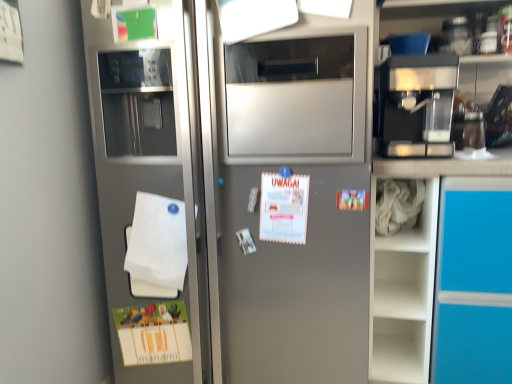
Image resolution: width=512 pixels, height=384 pixels. What do you see at coordinates (288, 197) in the screenshot? I see `satin silver refrigerator at left` at bounding box center [288, 197].

This screenshot has width=512, height=384. What do you see at coordinates (406, 241) in the screenshot?
I see `white fabric at right` at bounding box center [406, 241].

The image size is (512, 384). Identify the location of metallic espresso machine at upper right. (417, 105).

This screenshot has height=384, width=512. What do you see at coordinates (156, 247) in the screenshot?
I see `white matte notepad at lower left` at bounding box center [156, 247].

Locate an element on the screen. white matte paper at upper center is located at coordinates (254, 17).

This screenshot has width=512, height=384. What do you see at coordinates (254, 17) in the screenshot? I see `white matte paper at upper center` at bounding box center [254, 17].

The width and height of the screenshot is (512, 384). In order to click on satin silver refrigerator at left in this screenshot , I will do pyautogui.click(x=288, y=197).

Is metallic espresso machine at upper right in front of or behind white fabric at right in the image?

Clearly, metallic espresso machine at upper right is in front of white fabric at right.

Is metallic espresso machine at upper right surrounding white fabric at right?

No, white fabric at right is located outside of metallic espresso machine at upper right.

Which object is closer to the camera, white matte notepad at lower left or white matte paper at upper center?

white matte paper at upper center is closer to the camera.

Is white matte notepad at lower left outside of white matte paper at upper center?

Yes, white matte notepad at lower left is located beyond the bounds of white matte paper at upper center.

From the image's perspective, is white matte notepad at lower left above or below white matte paper at upper center?

Based on their image positions, white matte notepad at lower left is located beneath white matte paper at upper center.

In terms of height, does white fabric at right look taller or shorter compared to satin silver refrigerator at left?

white fabric at right is shorter than satin silver refrigerator at left.

Where is `refrigerator located above the white fabric at right (from a real-world perspective)`? The width and height of the screenshot is (512, 384). refrigerator located above the white fabric at right (from a real-world perspective) is located at coordinates (288, 197).

Is point (387, 241) farther from camera compared to point (254, 215)?

Yes, point (387, 241) is behind point (254, 215).

From a real-world perspective, is white matte notepad at lower left below satin silver refrigerator at left?

Yes.

Is white matte notepad at lower left far away from satin silver refrigerator at left?

No, white matte notepad at lower left is not far away from satin silver refrigerator at left.

Is point (166, 267) farther from viewer compared to point (302, 158)?

Yes, it is behind point (302, 158).

Based on their positions, is white matte notepad at lower left located to the left or right of satin silver refrigerator at left?

In the image, white matte notepad at lower left appears on the left side of satin silver refrigerator at left.

From a real-world perspective, who is located higher, white matte paper at upper center or white fabric at right?

From a 3D spatial view, white matte paper at upper center is above.

The height and width of the screenshot is (384, 512). I want to click on cabinet behind the white matte paper at upper center, so coord(406,241).

Is white matte paper at upper center not close to white fabric at right?

white matte paper at upper center is actually quite close to white fabric at right.

Consider the image. From the image's perspective, would you say white matte paper at upper center is shown under white fabric at right?

No, from the image's perspective, white matte paper at upper center is not beneath white fabric at right.

Which of these two, white fabric at right or metallic espresso machine at upper right, is smaller?

With smaller size is white fabric at right.

Is white fabric at right at the right side of metallic espresso machine at upper right?

In fact, white fabric at right is to the left of metallic espresso machine at upper right.

Does white fabric at right lie in front of metallic espresso machine at upper right?

No, white fabric at right is further to the viewer.

Is white fabric at right positioned with its back to metallic espresso machine at upper right?

white fabric at right does not have its back to metallic espresso machine at upper right.

Which of these two, white fabric at right or white matte paper at upper center, is thinner?

white matte paper at upper center.

Considering the points (430, 191) and (239, 5), which point is in front, point (430, 191) or point (239, 5)?

Positioned in front is point (239, 5).

What's the angular difference between white fabric at right and white matte paper at upper center's facing directions?

The facing directions of white fabric at right and white matte paper at upper center are 1.5 degrees apart.

From a real-world perspective, between white fabric at right and white matte paper at upper center, who is vertically lower?

white fabric at right is physically lower.

You are a GUI agent. You are given a task and a screenshot of the screen. Output one action in this format:
    pyautogui.click(x=<x>, y=<y>)
    Task: Click on the coffee machine located above the white fabric at right (from a real-world perspective)
    The width and height of the screenshot is (512, 384).
    Given the screenshot: What is the action you would take?
    pyautogui.click(x=417, y=105)

You are a GUI agent. You are given a task and a screenshot of the screen. Output one action in this format:
    pyautogui.click(x=<x>, y=<y>)
    Task: Click on the paper in front of the white matte notepad at lower left
    The width and height of the screenshot is (512, 384).
    Given the screenshot: What is the action you would take?
    pyautogui.click(x=254, y=17)

Looking at the image, which one is located closer to white fabric at right, white matte paper at upper center or white matte notepad at lower left?

white matte paper at upper center is positioned closer to the anchor white fabric at right.

Considering their positions, is metallic espresso machine at upper right positioned closer to white matte paper at upper center than satin silver refrigerator at left?

satin silver refrigerator at left.

Estimate the real-world distances between objects in this image. Which object is further from satin silver refrigerator at left, white fabric at right or white matte notepad at lower left?

Based on the image, white fabric at right appears to be further to satin silver refrigerator at left.

Considering their positions, is white matte paper at upper center positioned closer to white fabric at right than satin silver refrigerator at left?

satin silver refrigerator at left lies closer to white fabric at right than the other object.

From the image, which object appears to be nearer to satin silver refrigerator at left, white fabric at right or white matte paper at upper center?

white fabric at right lies closer to satin silver refrigerator at left than the other object.

Estimate the real-world distances between objects in this image. Which object is further from white matte notepad at lower left, white matte paper at upper center or white fabric at right?

Based on the image, white fabric at right appears to be further to white matte notepad at lower left.

Considering their positions, is white fabric at right positioned further to white matte paper at upper center than white matte notepad at lower left?

The object further to white matte paper at upper center is white fabric at right.

Which object lies further to the anchor point metallic espresso machine at upper right, white matte paper at upper center or satin silver refrigerator at left?

white matte paper at upper center is positioned further to the anchor metallic espresso machine at upper right.

In order to click on paper between white matte notepad at lower left and white fabric at right from left to right in this screenshot , I will do `click(254, 17)`.

At what (x,y) coordinates should I click in order to perform the action: click on refrigerator between white matte notepad at lower left and white fabric at right from left to right. Please return your answer as a coordinate pair (x, y). Looking at the image, I should click on (288, 197).

Identify the location of refrigerator between white matte paper at upper center and white fabric at right vertically. (288, 197).

The width and height of the screenshot is (512, 384). I want to click on paper between white matte notepad at lower left and metallic espresso machine at upper right in the horizontal direction, so click(254, 17).